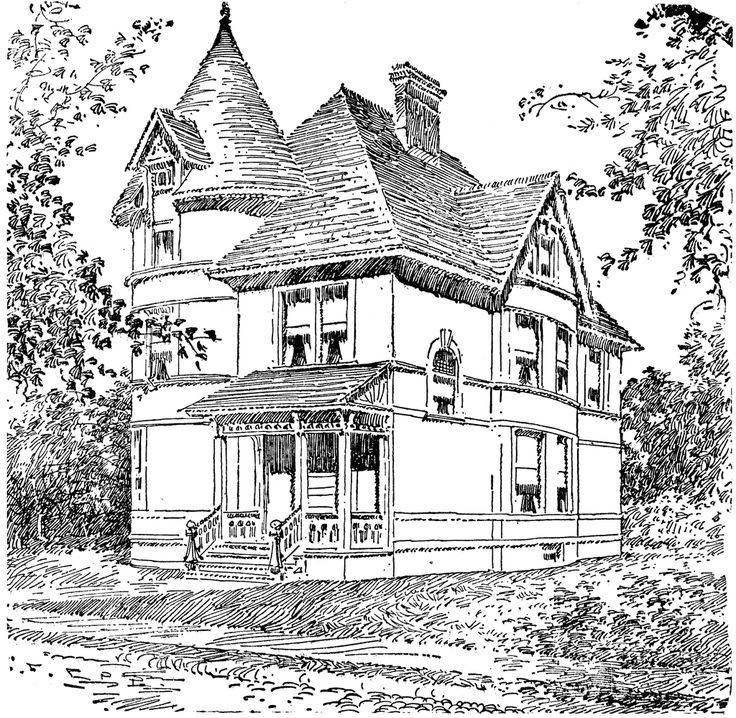
At what (x,y) coordinates should I click in order to perform the action: click on window. Please return your answer as a coordinate pair (x, y). This screenshot has height=718, width=736. Looking at the image, I should click on (305, 340).